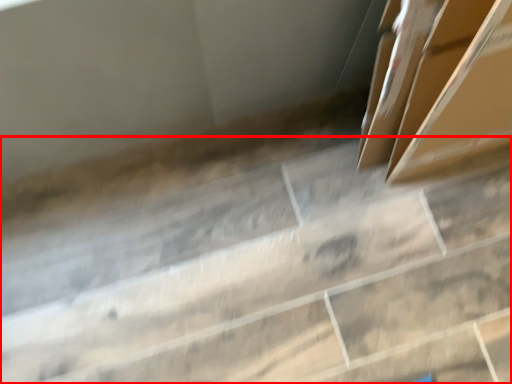
Question: From the image's perspective, considering the relative positions of concrete (annotated by the red box) and box in the image provided, where is concrete (annotated by the red box) located with respect to the staircase?

Choices:
 (A) above
 (B) below

Answer: (B)